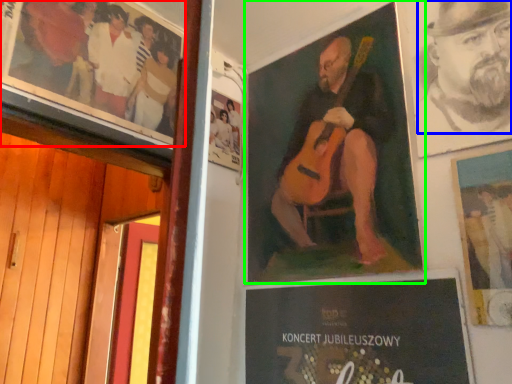
Question: Which is nearer to the poster (highlighted by a red box)? person (highlighted by a blue box) or poster (highlighted by a green box).

Choices:
 (A) person
 (B) poster

Answer: (B)